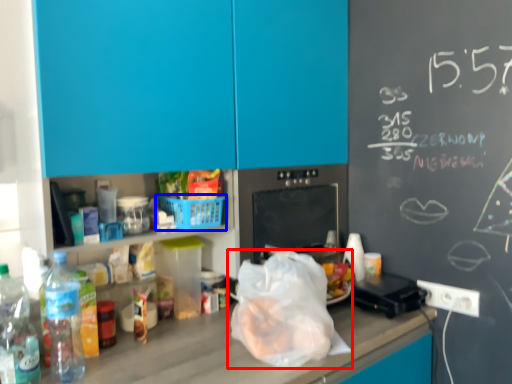
Question: Which point is further to the camera, plastic bag (highlighted by a red box) or basket (highlighted by a blue box)?

Choices:
 (A) plastic bag
 (B) basket

Answer: (B)